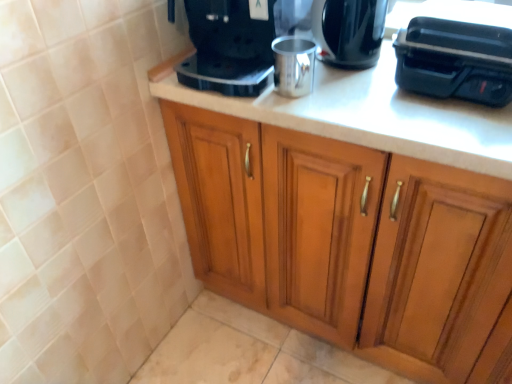
I want to click on vacant area that is in front of shiny black coffee maker at upper center, so click(x=359, y=100).